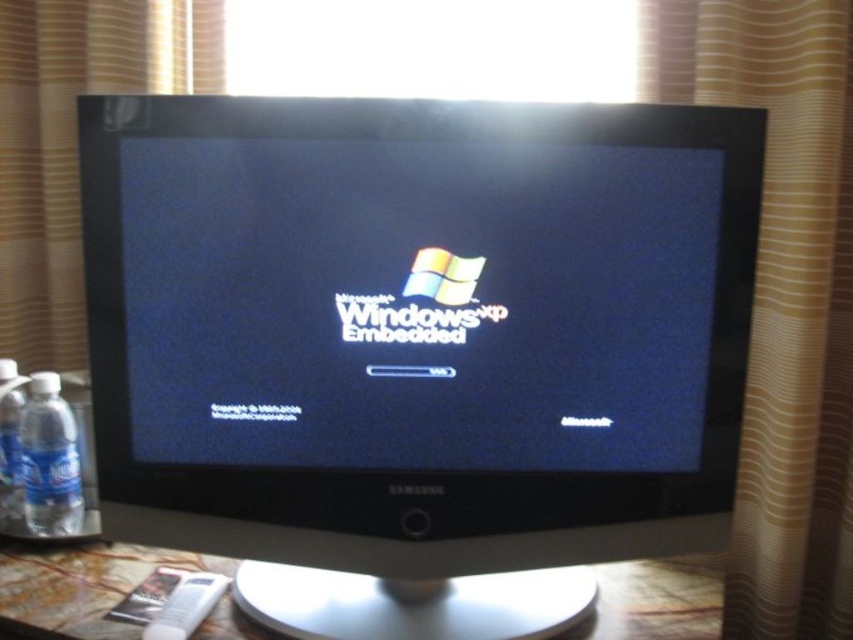
Based on the scene described, which object, the satin black monitor at center or the beige fabric curtain at right, occupies a greater area in the image?

The satin black monitor at center has a larger size compared to the beige fabric curtain at right, so it occupies a greater area in the image.

Based on the photo, you are setting up a desk and need to place both the satin black monitor at center and the clear plastic bottle at lower left on a shelf. The shelf has limited space. Based on their sizes, which item should you place first to ensure both fit properly?

The satin black monitor at center is larger in size than the clear plastic bottle at lower left. Therefore, you should place the satin black monitor at center first to ensure there is enough space left for the smaller clear plastic bottle at lower left.